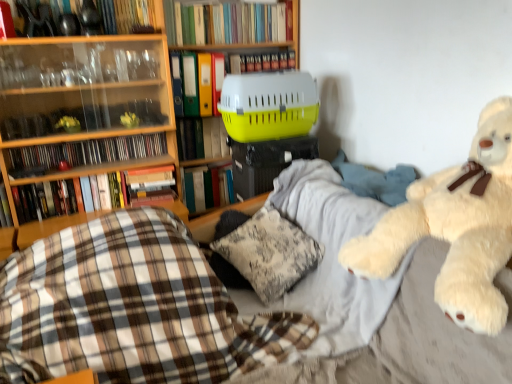
The image size is (512, 384). Find the location of `blank space above hardcover book at center, the 3th book ordered from the bottom (from a real-world perspective)`. blank space above hardcover book at center, the 3th book ordered from the bottom (from a real-world perspective) is located at coordinates (204, 161).